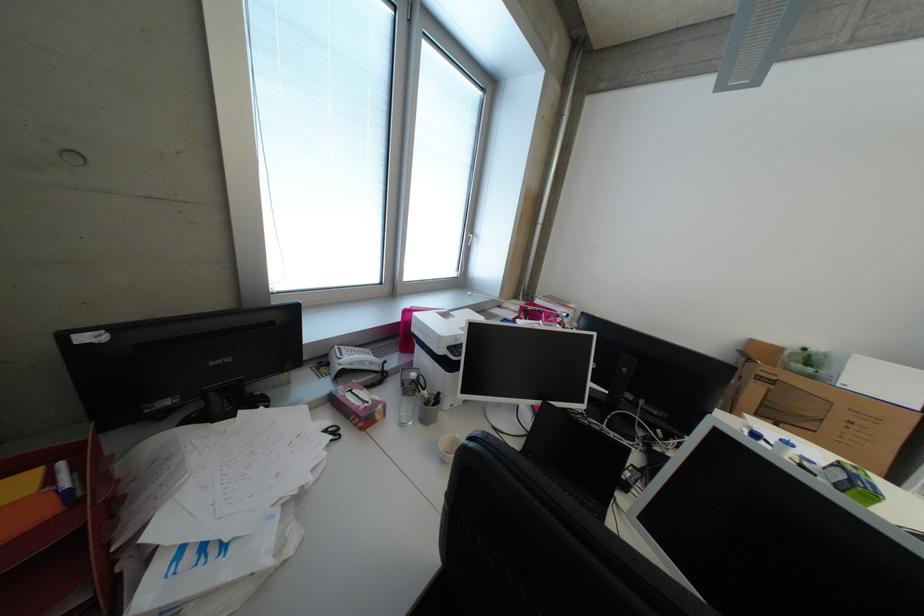
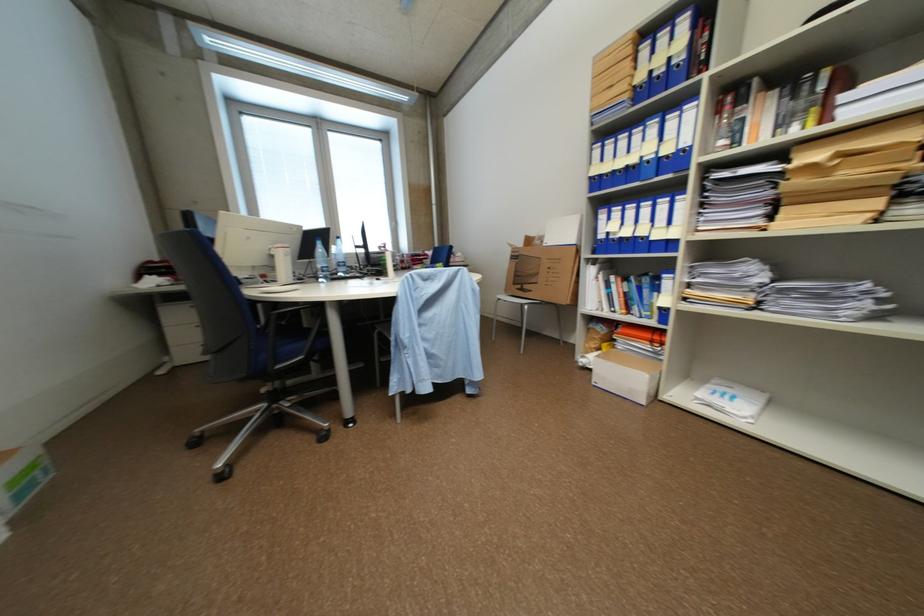
Question: The images are taken continuously from a first-person perspective. In which direction are you moving?

Choices:
 (A) Left
 (B) Right
 (C) Forward
 (D) Backward

Answer: (B)